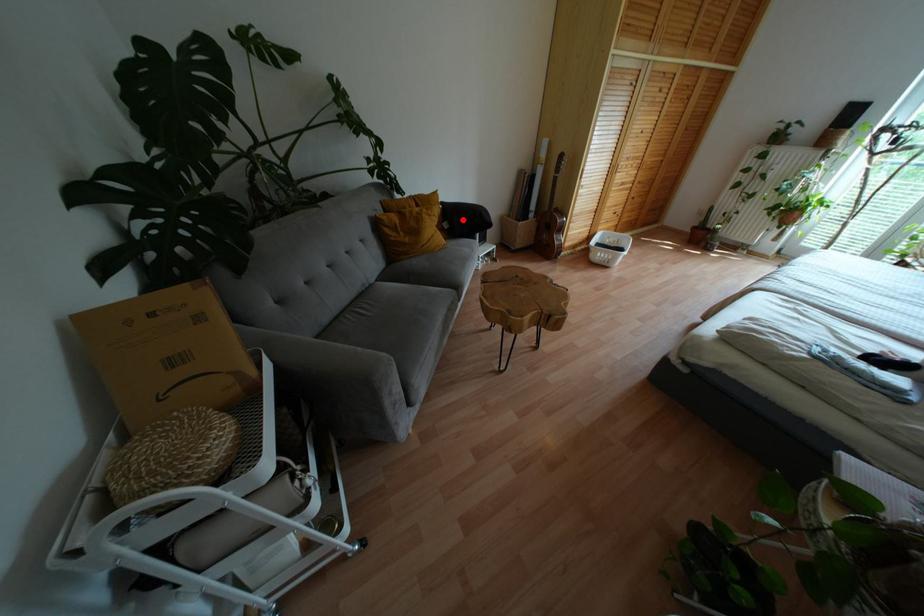
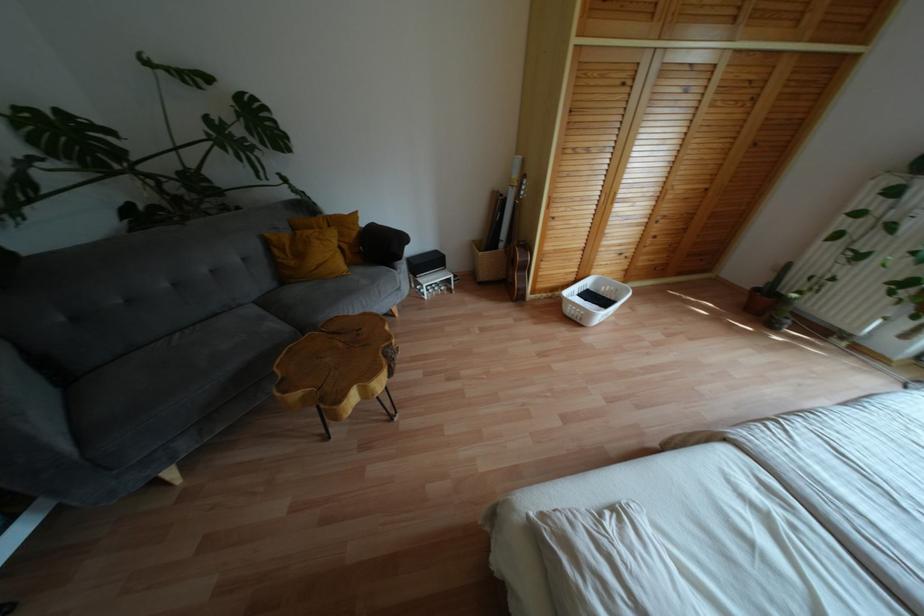
Question: I am providing you with two images of the same scene from different viewpoints. Given a red point in image1, look at the same physical point in image2. Is it:

Choices:
 (A) Closer to the viewpoint
 (B) Farther from the viewpoint

Answer: (B)